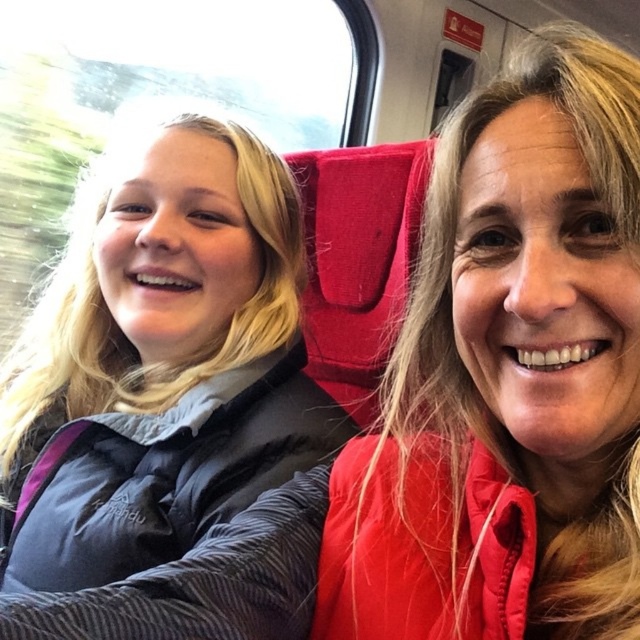
Can you confirm if matte red jacket at right is wider than brushed nylon jacket at left?

No, matte red jacket at right is not wider than brushed nylon jacket at left.

Is matte red jacket at right thinner than brushed nylon jacket at left?

Indeed, matte red jacket at right has a lesser width compared to brushed nylon jacket at left.

This screenshot has height=640, width=640. What do you see at coordinates (499, 378) in the screenshot?
I see `matte red jacket at right` at bounding box center [499, 378].

Identify the location of matte red jacket at right. This screenshot has height=640, width=640. (499, 378).